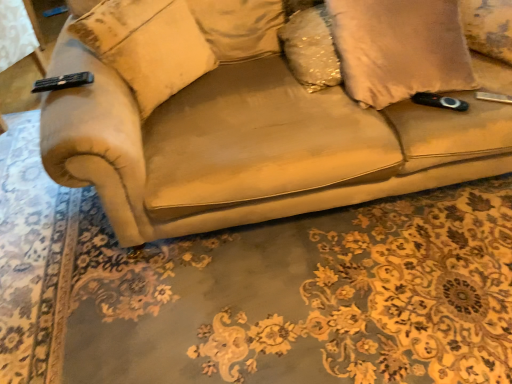
Question: Should I look upward or downward to see beige fabric pillow at left, positioned as the fourth pillow in right-to-left order?

Choices:
 (A) up
 (B) down

Answer: (A)

Question: From a real-world perspective, is sparkly gold pillow at upper center, which ranks as the third pillow in right-to-left order, beneath beige fabric pillow at left, which is the first pillow in left-to-right order?

Choices:
 (A) no
 (B) yes

Answer: (B)

Question: Is sparkly gold pillow at upper center, the second pillow positioned from the left, shorter than beige fabric pillow at left, which is the first pillow in left-to-right order?

Choices:
 (A) yes
 (B) no

Answer: (A)

Question: From a real-world perspective, is sparkly gold pillow at upper center, the second pillow positioned from the left, over beige fabric pillow at left, which is the first pillow in left-to-right order?

Choices:
 (A) no
 (B) yes

Answer: (A)

Question: Is beige fabric pillow at left, positioned as the fourth pillow in right-to-left order, surrounded by sparkly gold pillow at upper center, which ranks as the third pillow in right-to-left order?

Choices:
 (A) yes
 (B) no

Answer: (B)

Question: Can you confirm if sparkly gold pillow at upper center, the second pillow positioned from the left, is smaller than beige fabric pillow at left, which is the first pillow in left-to-right order?

Choices:
 (A) no
 (B) yes

Answer: (B)

Question: Is sparkly gold pillow at upper center, which ranks as the third pillow in right-to-left order, oriented towards beige fabric pillow at left, positioned as the fourth pillow in right-to-left order?

Choices:
 (A) no
 (B) yes

Answer: (A)

Question: Does suede-like beige pillow at upper right, which is the 4th pillow from left to right, contain suede-like beige pillow at right, positioned as the 3th pillow in left-to-right order?

Choices:
 (A) yes
 (B) no

Answer: (B)

Question: From the image's perspective, is suede-like beige pillow at upper right, which is the 4th pillow from left to right, over suede-like beige pillow at right, positioned as the 3th pillow in left-to-right order?

Choices:
 (A) yes
 (B) no

Answer: (A)

Question: Does suede-like beige pillow at upper right, which ranks as the 1th pillow in right-to-left order, have a smaller size compared to suede-like beige pillow at right, which is counted as the second pillow, starting from the right?

Choices:
 (A) no
 (B) yes

Answer: (B)

Question: Is the depth of suede-like beige pillow at upper right, which is the 4th pillow from left to right, greater than that of suede-like beige pillow at right, which is counted as the second pillow, starting from the right?

Choices:
 (A) yes
 (B) no

Answer: (A)

Question: Is suede-like beige pillow at upper right, which is the 4th pillow from left to right, far from suede-like beige pillow at right, which is counted as the second pillow, starting from the right?

Choices:
 (A) no
 (B) yes

Answer: (A)

Question: Is suede-like beige pillow at upper right, which ranks as the 1th pillow in right-to-left order, shorter than suede-like beige pillow at right, positioned as the 3th pillow in left-to-right order?

Choices:
 (A) yes
 (B) no

Answer: (A)

Question: Does beige fabric pillow at left, which is the first pillow in left-to-right order, have a smaller size compared to suede-like beige pillow at upper right, which is the 4th pillow from left to right?

Choices:
 (A) no
 (B) yes

Answer: (A)